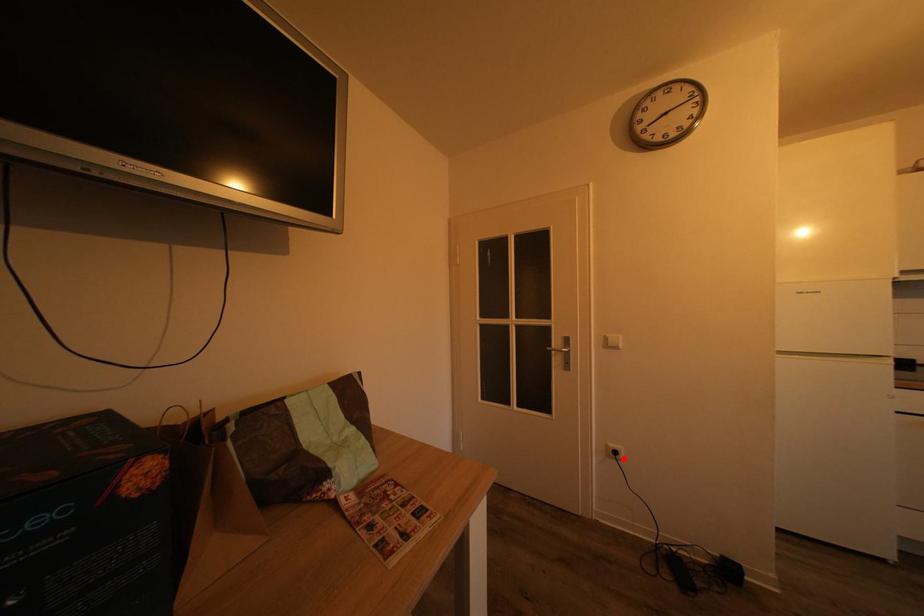
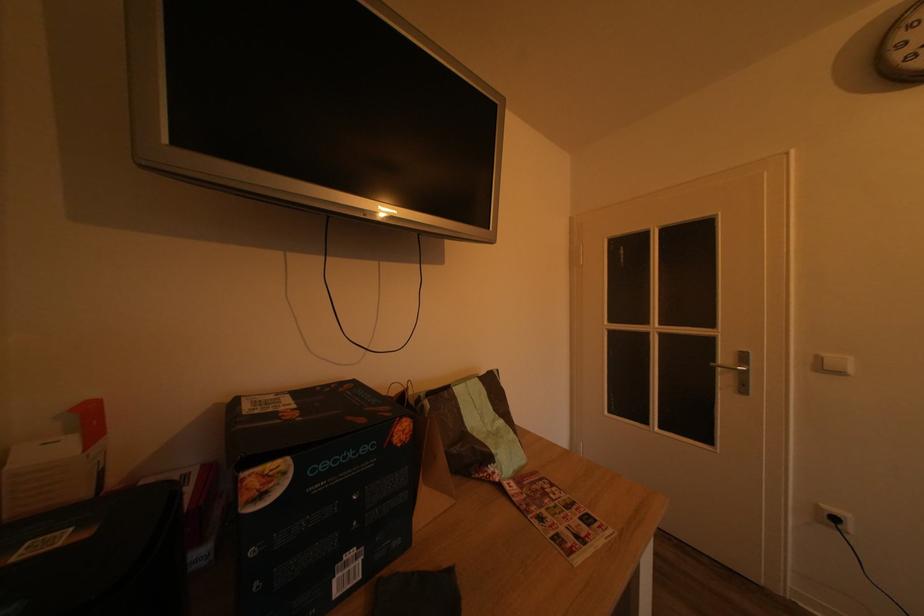
The point at the highlighted location is marked in the first image. Where is the corresponding point in the second image?

(843, 525)